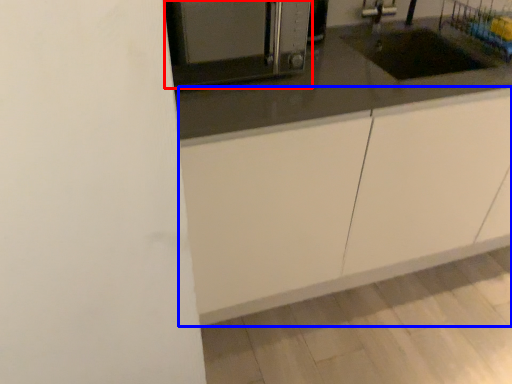
Question: Among these objects, which one is farthest to the camera, home appliance (highlighted by a red box) or cabinetry (highlighted by a blue box)?

Choices:
 (A) home appliance
 (B) cabinetry

Answer: (B)